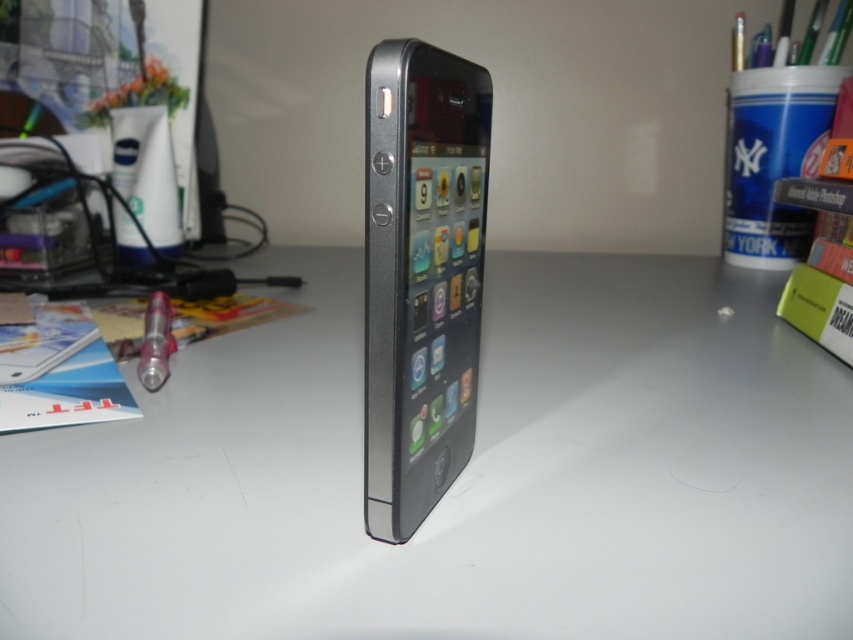
Question: Can you confirm if white matte table at center is bigger than metallic pen at left?

Choices:
 (A) yes
 (B) no

Answer: (A)

Question: Is white matte table at center to the left of metallic pen at left from the viewer's perspective?

Choices:
 (A) no
 (B) yes

Answer: (A)

Question: Considering the real-world distances, which object is farthest from the matte white lotion at left?

Choices:
 (A) white matte table at center
 (B) metallic pen at left

Answer: (A)

Question: Estimate the real-world distances between objects in this image. Which object is farther from the metallic pen at left?

Choices:
 (A) sleek black phone at center
 (B) white matte table at center

Answer: (A)

Question: Which of the following is the farthest from the observer?

Choices:
 (A) (148, 364)
 (B) (247, 356)
 (C) (386, 54)

Answer: (B)

Question: Can you confirm if white matte table at center is bigger than sleek black phone at center?

Choices:
 (A) no
 (B) yes

Answer: (B)